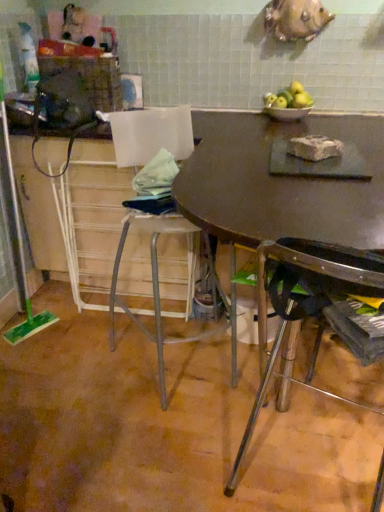
Question: Is white crumbly block at center positioned with its back to metallic silver stool at center, marked as the first chair in a left-to-right arrangement?

Choices:
 (A) no
 (B) yes

Answer: (A)

Question: Is white crumbly block at center behind metallic silver stool at center, marked as the first chair in a left-to-right arrangement?

Choices:
 (A) yes
 (B) no

Answer: (A)

Question: Is white crumbly block at center at the right side of metallic silver stool at center, marked as the first chair in a left-to-right arrangement?

Choices:
 (A) yes
 (B) no

Answer: (A)

Question: Is white crumbly block at center not close to metallic silver stool at center, which ranks as the second chair in right-to-left order?

Choices:
 (A) yes
 (B) no

Answer: (B)

Question: Does white crumbly block at center have a lesser height compared to metallic silver stool at center, which ranks as the second chair in right-to-left order?

Choices:
 (A) no
 (B) yes

Answer: (B)

Question: In the image, is green plastic screen door at left positioned in front of or behind dark brown wood table at center?

Choices:
 (A) front
 (B) behind

Answer: (B)

Question: From a real-world perspective, is green plastic screen door at left positioned above or below dark brown wood table at center?

Choices:
 (A) below
 (B) above

Answer: (B)

Question: Does point (3, 121) appear closer or farther from the camera than point (372, 144)?

Choices:
 (A) closer
 (B) farther

Answer: (B)

Question: From the image's perspective, relative to dark brown wood table at center, is green plastic screen door at left above or below?

Choices:
 (A) below
 (B) above

Answer: (B)

Question: Looking at the image, does white crumbly block at center seem bigger or smaller compared to green plastic screen door at left?

Choices:
 (A) small
 (B) big

Answer: (A)

Question: In the image, is white crumbly block at center positioned in front of or behind green plastic screen door at left?

Choices:
 (A) front
 (B) behind

Answer: (A)

Question: Would you say white crumbly block at center is inside or outside green plastic screen door at left?

Choices:
 (A) outside
 (B) inside

Answer: (A)

Question: Would you say white crumbly block at center is to the left or to the right of green plastic screen door at left in the picture?

Choices:
 (A) right
 (B) left

Answer: (A)

Question: In terms of height, does matte brown table at center look taller or shorter compared to dark brown wood table at center?

Choices:
 (A) tall
 (B) short

Answer: (B)

Question: Is matte brown table at center situated inside dark brown wood table at center or outside?

Choices:
 (A) outside
 (B) inside

Answer: (A)